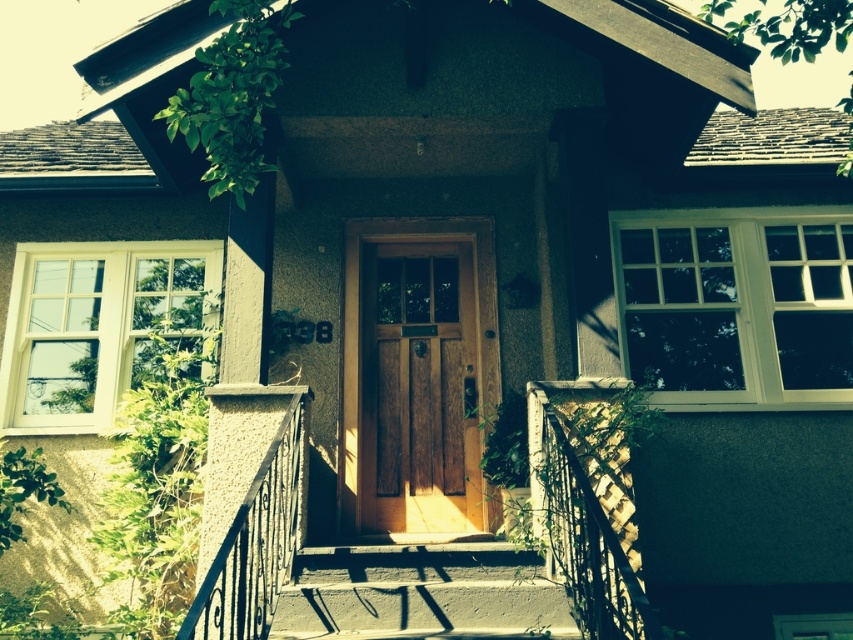
Question: Is concrete/steps at center above black wrought iron railing at center?

Choices:
 (A) no
 (B) yes

Answer: (A)

Question: Is wooden door at center thinner than black wrought iron railing at center?

Choices:
 (A) no
 (B) yes

Answer: (A)

Question: Does wooden door at center appear over wooden porch at center?

Choices:
 (A) no
 (B) yes

Answer: (B)

Question: Which of the following is the farthest from the observer?

Choices:
 (A) concrete/steps at center
 (B) wooden door at center
 (C) black wrought iron railing at center
 (D) wooden porch at center

Answer: (B)

Question: Considering the real-world distances, which object is farthest from the wooden door at center?

Choices:
 (A) wooden porch at center
 (B) black wrought iron railing at center

Answer: (B)

Question: Among these objects, which one is farthest from the camera?

Choices:
 (A) concrete/steps at center
 (B) wooden door at center

Answer: (B)